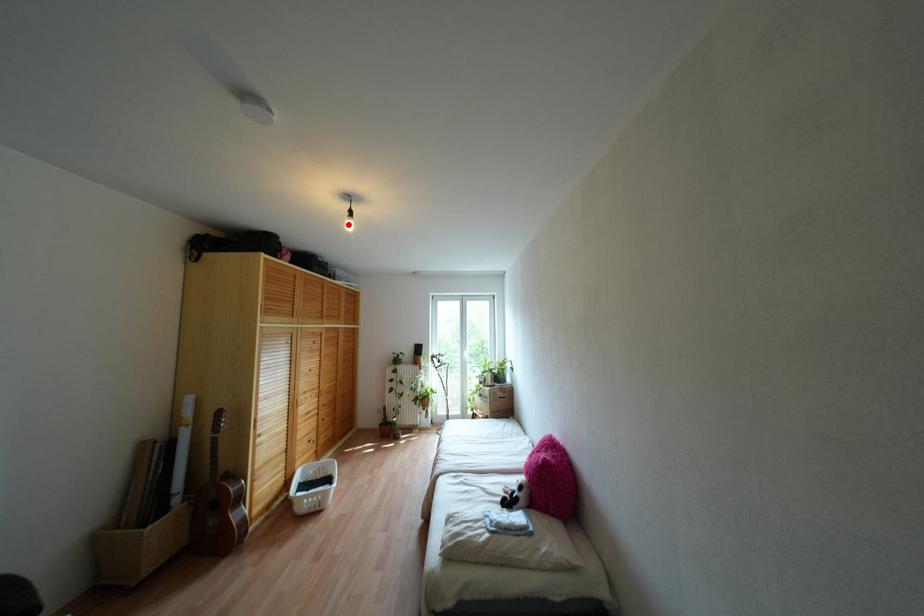
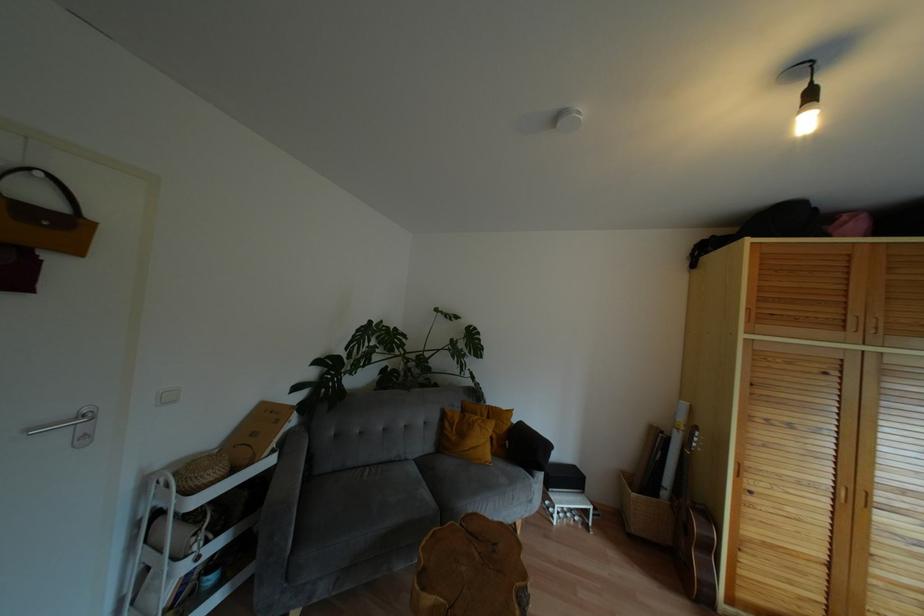
The point at the highlighted location is marked in the first image. Where is the corresponding point in the second image?

(806, 123)